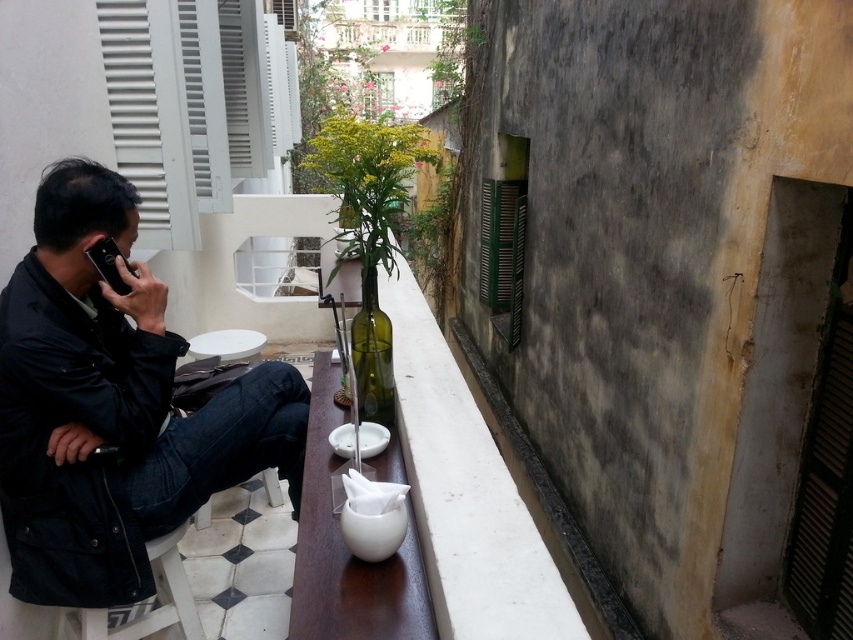
You are standing on the balcony and want to place a new decorative item on the railing. The point marked at coordinates (x=112, y=406) is where the black matte jacket is located. Considering the jacket is at that position, where would you place the new item to ensure it doesn t interfere with the jacket?

The point marked at (x=112, y=406) indicates the location of the black matte jacket at left. To avoid interference, place the new item away from this coordinate, perhaps on the opposite side of the railing or further along the railing away from the jacket.

You are designing a new outfit and need to know the relative sizes of items in the scene. Which object is wider, the black matte jacket at left or the white concrete ledge at center?

The black matte jacket at left is wider than the white concrete ledge at center according to the description.

You are a delivery person trying to place a large package on the white glossy table at center. The package is as big as the black matte jacket at left. Will the package fit on the table?

The black matte jacket at left is bigger than the white glossy table at center, so the package, being the same size as the jacket, will not fit on the table.